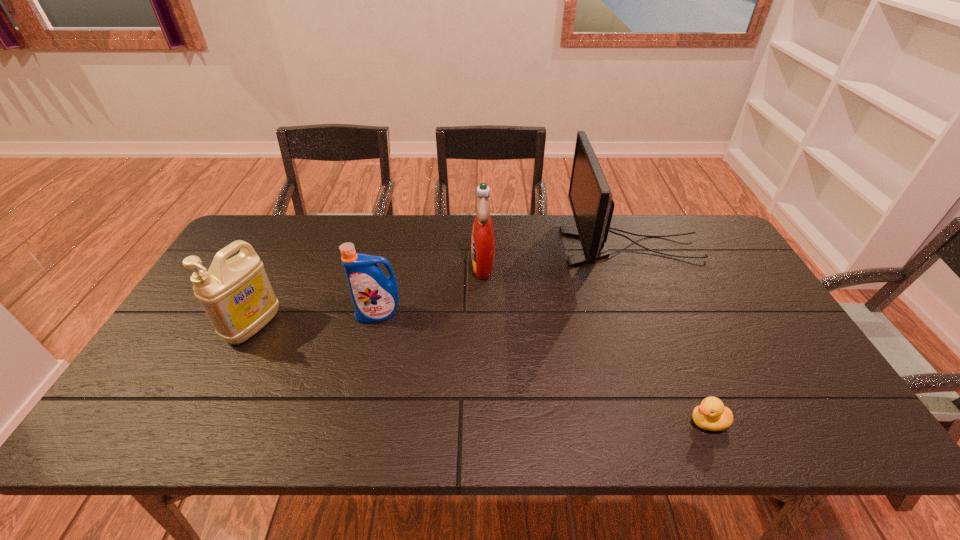
Image resolution: width=960 pixels, height=540 pixels. What are the coordinates of `free area in between the leftmost detergent and the computer monitor` in the screenshot? It's located at (443, 287).

Identify the location of vacant space that's between the computer monitor and the nearest object. (669, 334).

The width and height of the screenshot is (960, 540). I want to click on vacant area that lies between the leftmost detergent and the second object from left to right, so click(316, 320).

In order to click on vacant area that lies between the leftmost object and the fourth object from right to left in this screenshot , I will do 316,320.

At what (x,y) coordinates should I click in order to perform the action: click on vacant area that lies between the computer monitor and the duckling. Please return your answer as a coordinate pair (x, y). Looking at the image, I should click on (669, 334).

You are a GUI agent. You are given a task and a screenshot of the screen. Output one action in this format:
    pyautogui.click(x=<x>, y=<y>)
    Task: Click on the free space between the second detergent from right to left and the shortest object
    This screenshot has height=540, width=960.
    Given the screenshot: What is the action you would take?
    pyautogui.click(x=543, y=368)

The width and height of the screenshot is (960, 540). Identify the location of empty space between the third object from right to left and the nearest object. (595, 343).

I want to click on vacant space that is in between the second object from left to right and the shortest object, so click(543, 368).

You are a GUI agent. You are given a task and a screenshot of the screen. Output one action in this format:
    pyautogui.click(x=<x>, y=<y>)
    Task: Click on the free space between the rightmost detergent and the nearest object
    Image resolution: width=960 pixels, height=540 pixels.
    Given the screenshot: What is the action you would take?
    point(595,343)

The width and height of the screenshot is (960, 540). In order to click on vacant area that lies between the computer monitor and the leftmost object in this screenshot , I will do `click(443, 287)`.